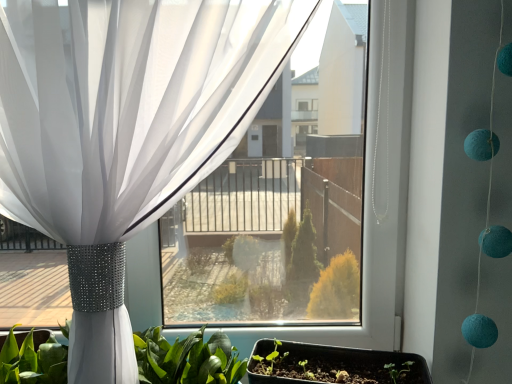
Question: Does green leafy plant at lower center have a smaller size compared to matte black tray at lower center?

Choices:
 (A) yes
 (B) no

Answer: (B)

Question: Can you confirm if green leafy plant at lower center is positioned to the right of matte black tray at lower center?

Choices:
 (A) no
 (B) yes

Answer: (A)

Question: Can you see green leafy plant at lower center touching matte black tray at lower center?

Choices:
 (A) yes
 (B) no

Answer: (B)

Question: From the image's perspective, is green leafy plant at lower center located beneath matte black tray at lower center?

Choices:
 (A) yes
 (B) no

Answer: (B)

Question: Does green leafy plant at lower center appear on the left side of matte black tray at lower center?

Choices:
 (A) yes
 (B) no

Answer: (A)

Question: From a real-world perspective, is white sheer curtain at upper left above or below green leafy plant at lower center?

Choices:
 (A) below
 (B) above

Answer: (B)

Question: Does point (157, 139) appear closer or farther from the camera than point (170, 360)?

Choices:
 (A) closer
 (B) farther

Answer: (A)

Question: Looking at the image, does white sheer curtain at upper left seem bigger or smaller compared to green leafy plant at lower center?

Choices:
 (A) small
 (B) big

Answer: (B)

Question: Considering the relative positions of white sheer curtain at upper left and green leafy plant at lower center in the image provided, is white sheer curtain at upper left to the left or to the right of green leafy plant at lower center?

Choices:
 (A) right
 (B) left

Answer: (A)

Question: Based on their positions, is green leafy plant at lower center located to the left or right of white sheer curtain at upper left?

Choices:
 (A) left
 (B) right

Answer: (A)

Question: Choose the correct answer: Is green leafy plant at lower center inside white sheer curtain at upper left or outside it?

Choices:
 (A) outside
 (B) inside

Answer: (B)

Question: Does point (42, 370) appear closer or farther from the camera than point (312, 3)?

Choices:
 (A) closer
 (B) farther

Answer: (B)

Question: Considering the positions of green leafy plant at lower center and white sheer curtain at upper left in the image, is green leafy plant at lower center taller or shorter than white sheer curtain at upper left?

Choices:
 (A) short
 (B) tall

Answer: (A)

Question: Is point (257, 352) positioned closer to the camera than point (46, 102)?

Choices:
 (A) farther
 (B) closer

Answer: (A)

Question: From a real-world perspective, is matte black tray at lower center physically located above or below white sheer curtain at upper left?

Choices:
 (A) below
 (B) above

Answer: (A)